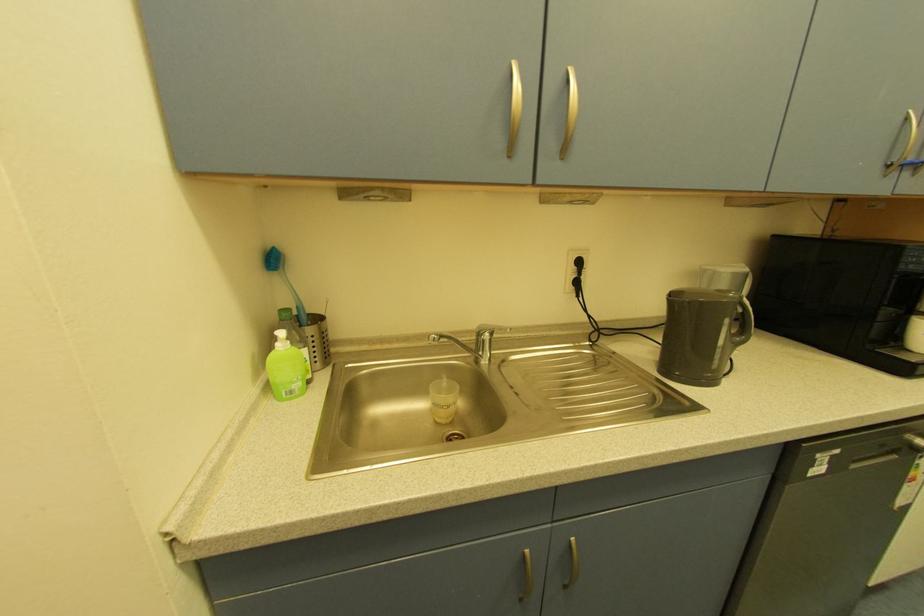
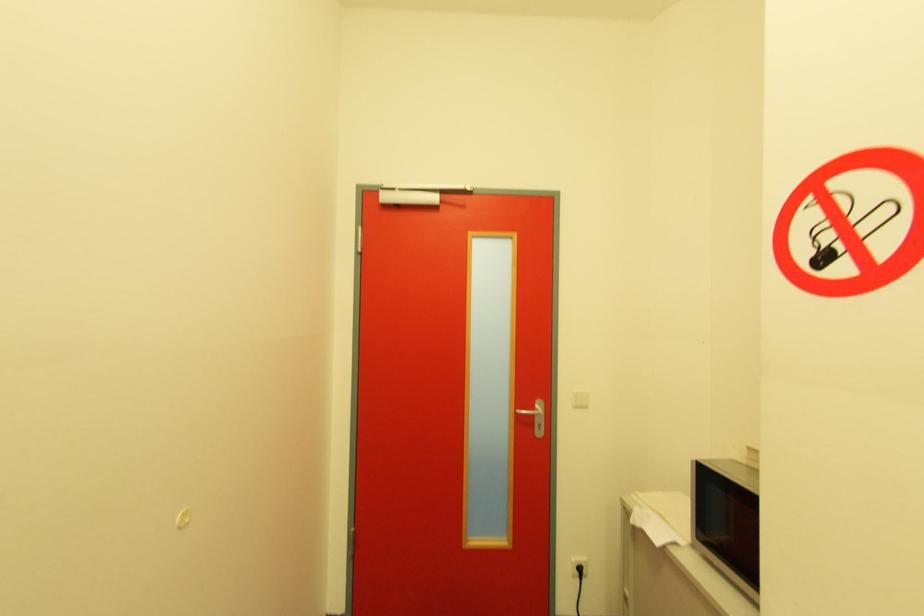
Question: The camera is either moving clockwise (left) or counter-clockwise (right) around the object. The first image is from the beginning of the video and the second image is from the end. Is the camera moving left or right when shooting the video?

Choices:
 (A) Left
 (B) Right

Answer: (B)